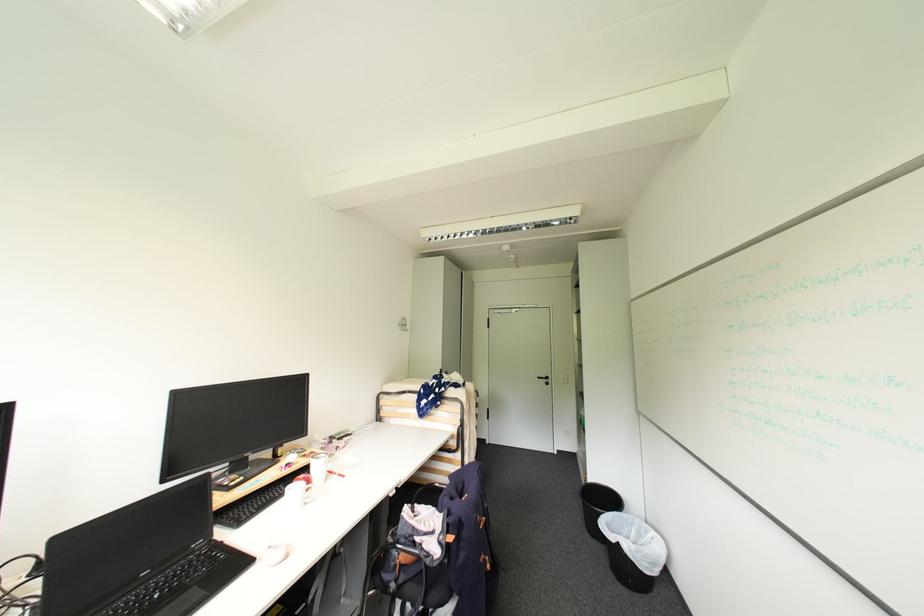
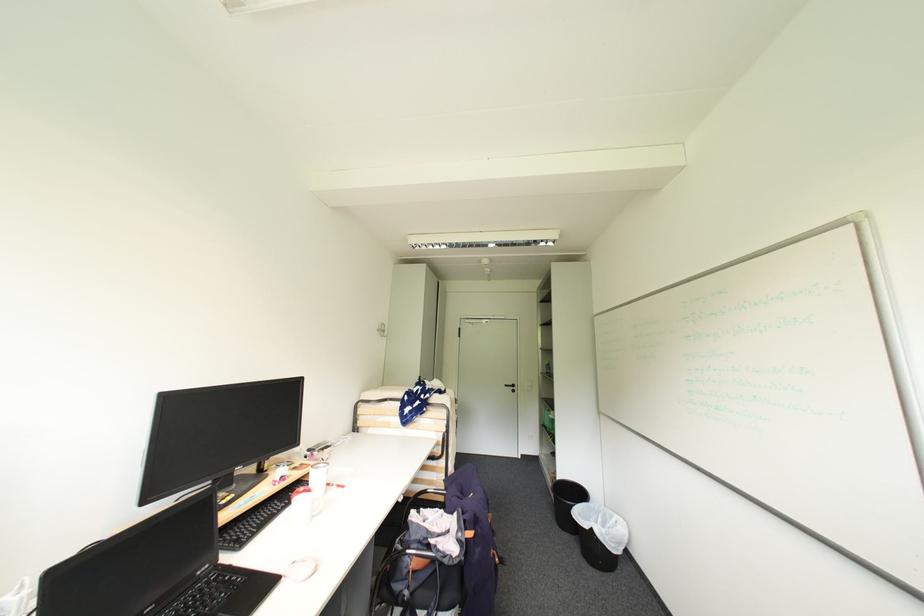
Question: Which direction would the cameraman need to move to produce the second image? Reply with the corresponding letter.

Choices:
 (A) Left
 (B) Right
 (C) Forward
 (D) Backward

Answer: (A)